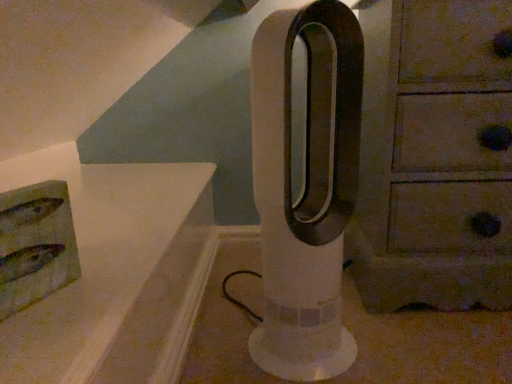
Question: Does wooden chest of drawers at right appear on the right side of white plastic fan at center?

Choices:
 (A) no
 (B) yes

Answer: (B)

Question: Is wooden chest of drawers at right completely or partially outside of white plastic fan at center?

Choices:
 (A) yes
 (B) no

Answer: (A)

Question: Could white plastic fan at center be considered to be inside wooden chest of drawers at right?

Choices:
 (A) yes
 (B) no

Answer: (B)

Question: Does wooden chest of drawers at right have a lesser height compared to white plastic fan at center?

Choices:
 (A) no
 (B) yes

Answer: (A)

Question: Does wooden chest of drawers at right have a smaller size compared to white plastic fan at center?

Choices:
 (A) no
 (B) yes

Answer: (A)

Question: From the image's perspective, would you say wooden chest of drawers at right is positioned over white plastic fan at center?

Choices:
 (A) yes
 (B) no

Answer: (A)

Question: Is white plastic fan at center directly adjacent to wooden chest of drawers at right?

Choices:
 (A) no
 (B) yes

Answer: (A)

Question: Considering the relative positions of white plastic fan at center and wooden chest of drawers at right in the image provided, is white plastic fan at center in front of wooden chest of drawers at right?

Choices:
 (A) no
 (B) yes

Answer: (B)

Question: Does white plastic fan at center have a lesser height compared to wooden chest of drawers at right?

Choices:
 (A) no
 (B) yes

Answer: (B)

Question: Does white plastic fan at center have a greater height compared to wooden chest of drawers at right?

Choices:
 (A) no
 (B) yes

Answer: (A)

Question: From a real-world perspective, is white plastic fan at center located beneath wooden chest of drawers at right?

Choices:
 (A) no
 (B) yes

Answer: (B)

Question: From the image's perspective, does white plastic fan at center appear lower than wooden chest of drawers at right?

Choices:
 (A) no
 (B) yes

Answer: (B)

Question: Is white plastic fan at center taller or shorter than wooden chest of drawers at right?

Choices:
 (A) short
 (B) tall

Answer: (A)